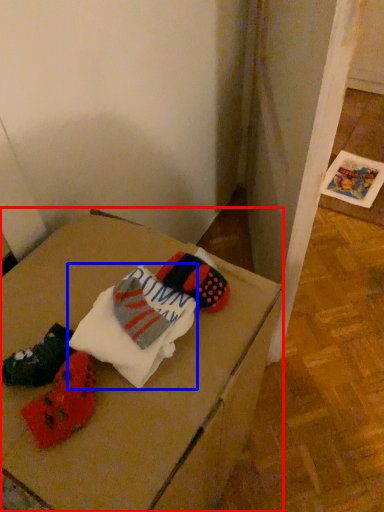
Question: Which of the following is the farthest to the observer, furniture (highlighted by a red box) or sheet (highlighted by a blue box)?

Choices:
 (A) furniture
 (B) sheet

Answer: (B)